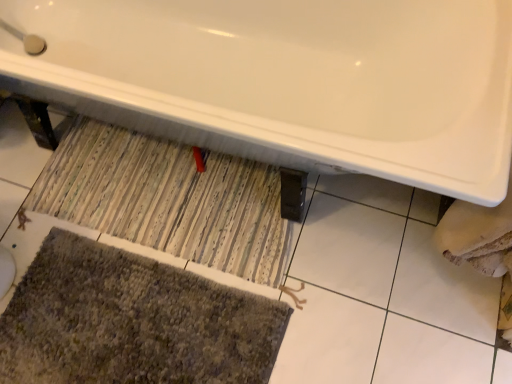
Question: From a real-world perspective, does textured gray bath mat at lower left sit lower than striped fabric doormat at center?

Choices:
 (A) no
 (B) yes

Answer: (B)

Question: Does textured gray bath mat at lower left lie behind striped fabric doormat at center?

Choices:
 (A) yes
 (B) no

Answer: (B)

Question: From the image's perspective, would you say textured gray bath mat at lower left is positioned over striped fabric doormat at center?

Choices:
 (A) no
 (B) yes

Answer: (A)

Question: Is the depth of textured gray bath mat at lower left less than that of striped fabric doormat at center?

Choices:
 (A) yes
 (B) no

Answer: (A)

Question: Is textured gray bath mat at lower left turned away from striped fabric doormat at center?

Choices:
 (A) yes
 (B) no

Answer: (B)

Question: Choose the correct answer: Is striped fabric doormat at center inside textured gray bath mat at lower left or outside it?

Choices:
 (A) outside
 (B) inside

Answer: (A)

Question: Is striped fabric doormat at center in front of or behind textured gray bath mat at lower left in the image?

Choices:
 (A) behind
 (B) front

Answer: (A)

Question: Considering the positions of point (240, 274) and point (121, 344), is point (240, 274) closer or farther from the camera than point (121, 344)?

Choices:
 (A) closer
 (B) farther

Answer: (B)

Question: Is striped fabric doormat at center wider or thinner than textured gray bath mat at lower left?

Choices:
 (A) wide
 (B) thin

Answer: (B)

Question: Is textured gray bath mat at lower left taller or shorter than white glossy bathtub at upper center?

Choices:
 (A) short
 (B) tall

Answer: (A)

Question: Would you say textured gray bath mat at lower left is inside or outside white glossy bathtub at upper center?

Choices:
 (A) inside
 (B) outside

Answer: (B)

Question: From a real-world perspective, relative to white glossy bathtub at upper center, is textured gray bath mat at lower left vertically above or below?

Choices:
 (A) below
 (B) above

Answer: (A)

Question: In terms of width, does textured gray bath mat at lower left look wider or thinner when compared to white glossy bathtub at upper center?

Choices:
 (A) thin
 (B) wide

Answer: (A)

Question: In terms of size, does striped fabric doormat at center appear bigger or smaller than white glossy bathtub at upper center?

Choices:
 (A) small
 (B) big

Answer: (A)

Question: From their relative heights in the image, would you say striped fabric doormat at center is taller or shorter than white glossy bathtub at upper center?

Choices:
 (A) tall
 (B) short

Answer: (B)